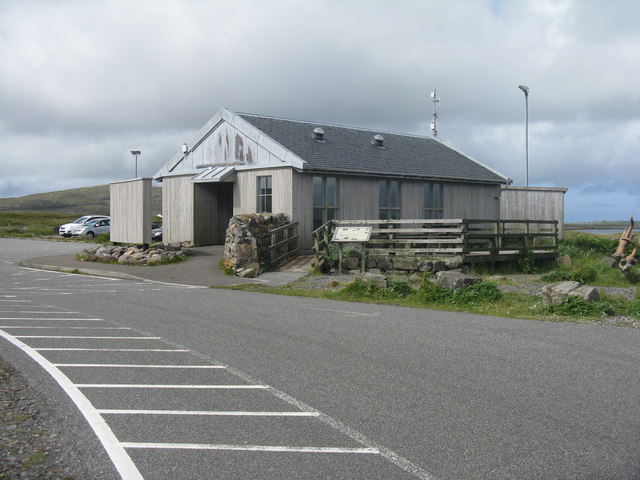
You are a GUI agent. You are given a task and a screenshot of the screen. Output one action in this format:
    pyautogui.click(x=<x>, y=<y>)
    Task: Click on the window
    
    Given the screenshot: What is the action you would take?
    [x=257, y=209]